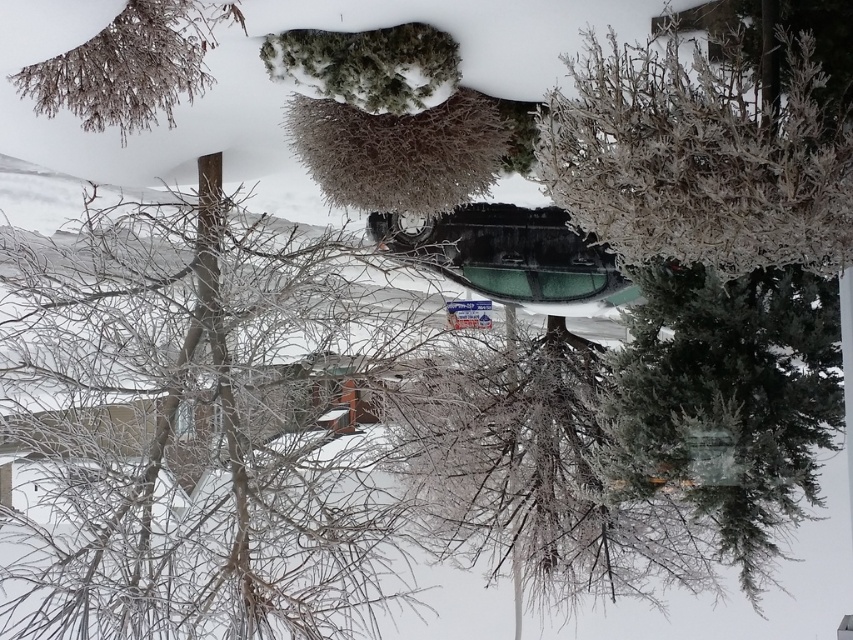
You are a photographer trying to capture the frosted white tree at center and the frosted brown branches at upper left in a single frame. Given that your camera can only focus on objects within a 10 meter width, will both objects fit in the frame?

The frosted white tree at center is wider than the frosted brown branches at upper left. However, without knowing the exact width of the frosted white tree at center, it is impossible to determine if both will fit within the 10 meter width constraint.

From the picture: You are standing in the snowy outdoor scene and want to take a photo of the frosted white tree at center. If your camera has a minimum focusing distance of 3 meters, will you be able to take a clear photo without moving closer?

The frosted white tree at center is 3.11 meters away from the camera. Since the minimum focusing distance is 3 meters, the camera can focus on the tree as it is slightly beyond the minimum requirement, allowing for a clear photo without needing to move closer.

You are standing in the snowy scene and want to walk from the frosted brown branches at upper left to the frosted white tree at center. Which direction should you head?

You should head to the right to reach the frosted white tree at center from the frosted brown branches at upper left since it is located to the right of them.